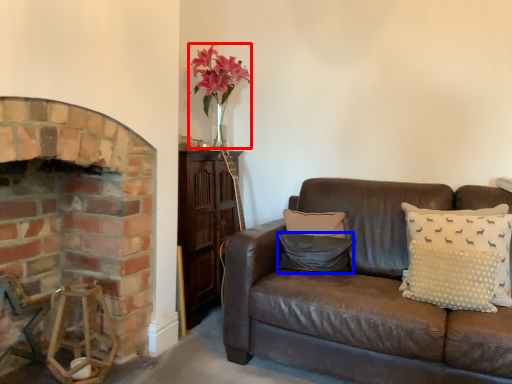
Question: Which of the following is the closest to the observer, floral arrangement (highlighted by a red box) or pillow (highlighted by a blue box)?

Choices:
 (A) floral arrangement
 (B) pillow

Answer: (B)